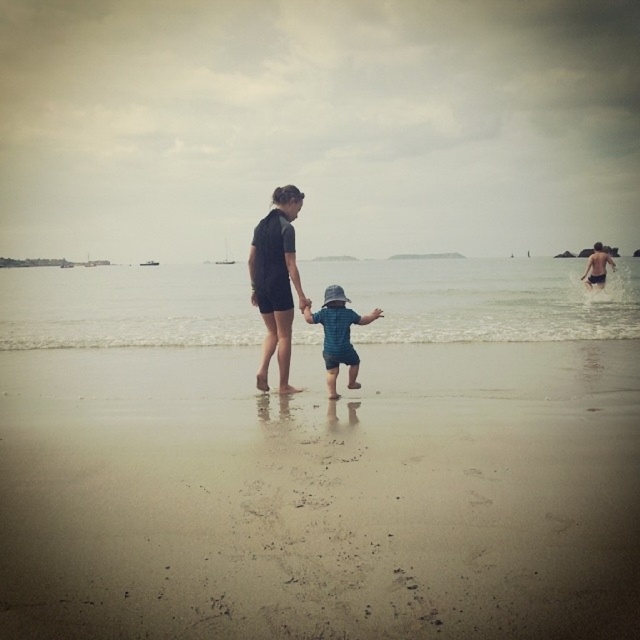
Question: Is clear water at center in front of blue denim shorts at center?

Choices:
 (A) no
 (B) yes

Answer: (A)

Question: Based on their relative distances, which object is nearer to the clear water at center?

Choices:
 (A) blue denim shorts at center
 (B) brown sandy beach at center
 (C) matte black wetsuit at center

Answer: (A)

Question: Does brown sandy beach at center appear on the right side of blue denim shorts at center?

Choices:
 (A) no
 (B) yes

Answer: (B)

Question: Considering the real-world distances, which object is closest to the clear water at center?

Choices:
 (A) brown sandy beach at center
 (B) matte black wetsuit at center
 (C) blue denim shorts at center

Answer: (C)

Question: Among these points, which one is farthest from the camera?

Choices:
 (A) (262, 264)
 (B) (497, 304)
 (C) (70, 429)
 (D) (353, 356)

Answer: (B)

Question: Is clear water at center closer to camera compared to blue denim shorts at center?

Choices:
 (A) yes
 (B) no

Answer: (B)